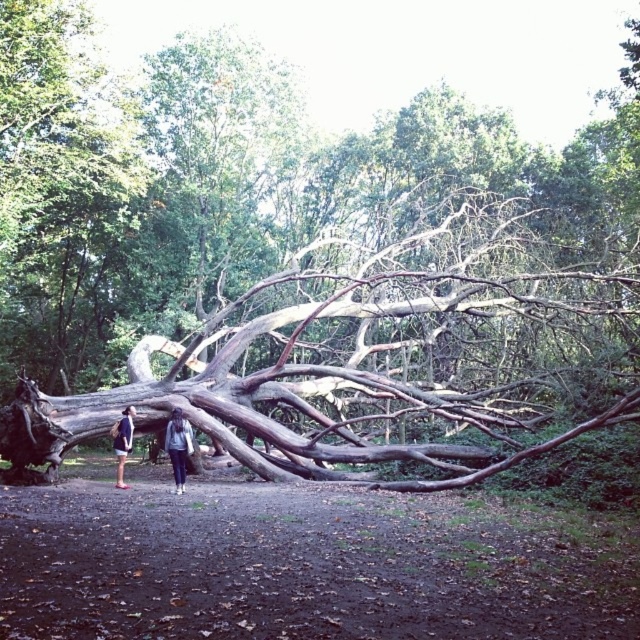
Is point (129, 557) positioned after point (168, 429)?

No.

Based on the photo, which of these two, brown dirt path at lower center or denim jacket at center, stands shorter?

Standing shorter between the two is brown dirt path at lower center.

Is point (568, 547) positioned behind point (176, 488)?

No, (568, 547) is in front of (176, 488).

Locate an element on the screen. brown dirt path at lower center is located at coordinates (307, 564).

Does brown dirt path at lower center have a greater width compared to denim shorts at lower left?

Yes, brown dirt path at lower center is wider than denim shorts at lower left.

Measure the distance between point (618, 602) and camera.

Point (618, 602) is 3.92 meters from camera.

Identify the location of brown dirt path at lower center. (307, 564).

Consider the image. Who is more distant from viewer, (186, 435) or (118, 426)?

The point (118, 426) is behind.

Which is more to the right, denim jacket at center or denim shorts at lower left?

Positioned to the right is denim jacket at center.

Does point (186, 468) come closer to viewer compared to point (122, 416)?

Yes, it is in front of point (122, 416).

In order to click on denim jacket at center in this screenshot , I will do `click(179, 445)`.